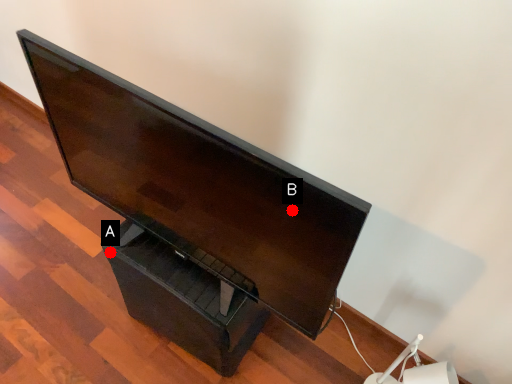
Question: Two points are circled on the image, labeled by A and B beside each circle. Among these points, which one is farthest from the camera?

Choices:
 (A) A is further
 (B) B is further

Answer: (A)